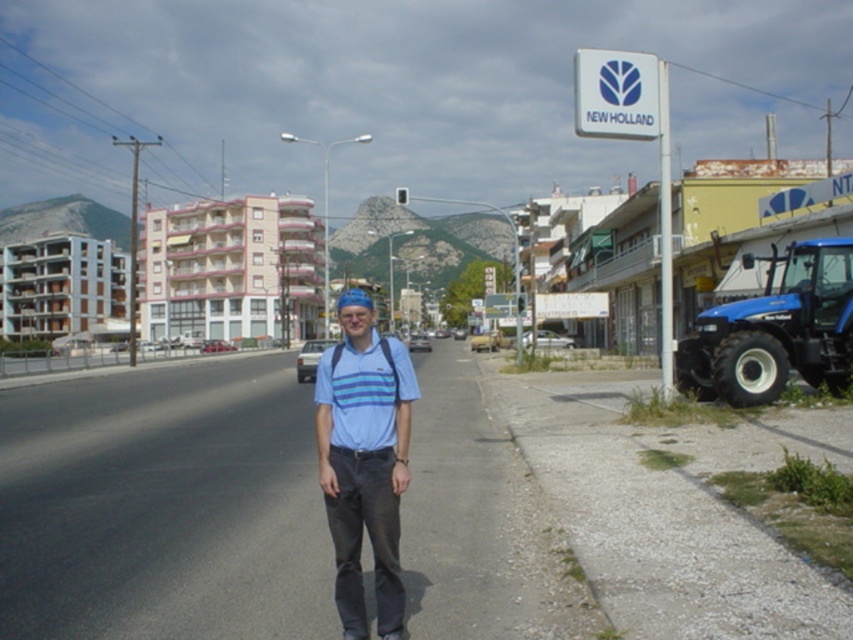
Question: Which point is farther to the camera?

Choices:
 (A) (825, 280)
 (B) (314, 396)
 (C) (398, 371)

Answer: (B)

Question: Which object is farther from the camera taking this photo?

Choices:
 (A) blue striped polo shirt at center
 (B) blue rubber tractor at right
 (C) blue striped shirt at center

Answer: (B)

Question: Can you confirm if blue striped shirt at center is positioned to the right of blue rubber tractor at right?

Choices:
 (A) no
 (B) yes

Answer: (A)

Question: In this image, where is blue rubber tractor at right located relative to blue striped polo shirt at center?

Choices:
 (A) below
 (B) above

Answer: (B)

Question: Does blue striped shirt at center appear over blue rubber tractor at right?

Choices:
 (A) yes
 (B) no

Answer: (B)

Question: Based on their relative distances, which object is nearer to the blue striped polo shirt at center?

Choices:
 (A) blue striped shirt at center
 (B) blue rubber tractor at right

Answer: (A)